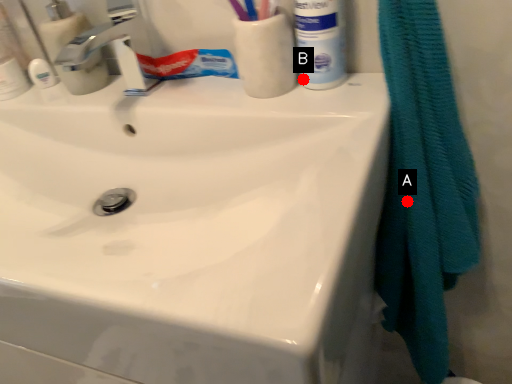
Question: Two points are circled on the image, labeled by A and B beside each circle. Which point appears farthest from the camera in this image?

Choices:
 (A) A is further
 (B) B is further

Answer: (B)